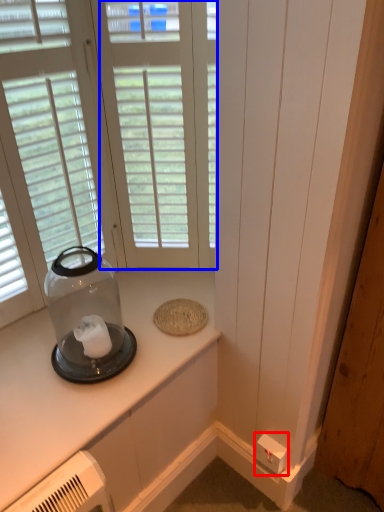
Question: Among these objects, which one is farthest to the camera, electric outlet (highlighted by a red box) or window (highlighted by a blue box)?

Choices:
 (A) electric outlet
 (B) window

Answer: (A)